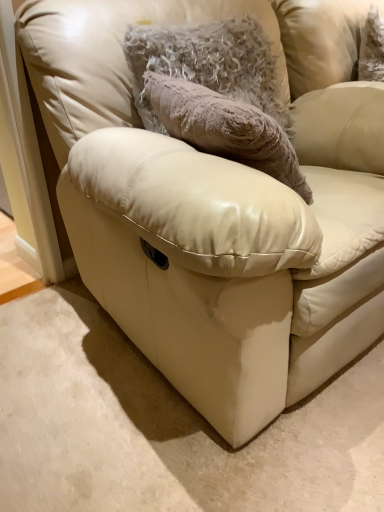
Question: Should I look upward or downward to see fuzzy gray pillow at upper center?

Choices:
 (A) up
 (B) down

Answer: (A)